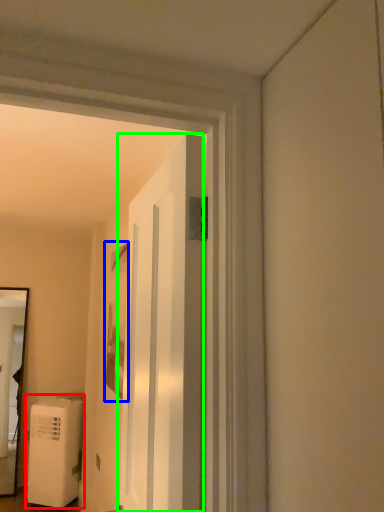
Question: Estimate the real-world distances between objects in this image. Which object is closer to water heater (highlighted by a red box), picture frame (highlighted by a blue box) or door (highlighted by a green box)?

Choices:
 (A) picture frame
 (B) door

Answer: (A)